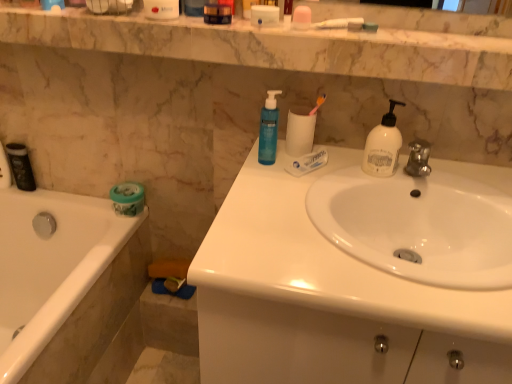
Find the location of a particular element. Image resolution: width=512 pixels, height=384 pixels. empty space that is in between black matte canister at left and green matte jar at lower left, the 1th toilet paper viewed from the left is located at coordinates (73, 201).